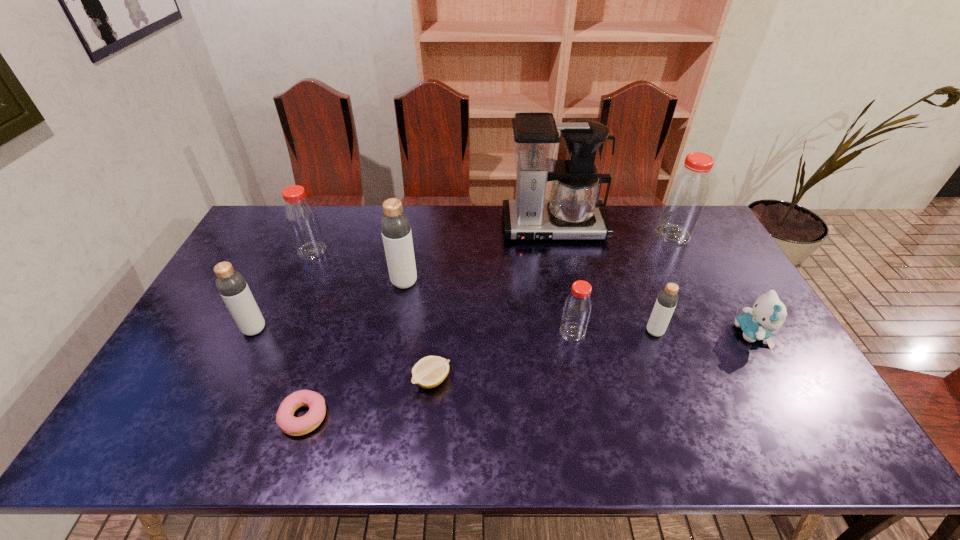
Where is `coffee maker situated at the far edge`? The height and width of the screenshot is (540, 960). coffee maker situated at the far edge is located at coordinates (574, 212).

Locate an element on the screen. object located in the near edge section of the desktop is located at coordinates (295, 426).

The width and height of the screenshot is (960, 540). I want to click on object that is at the left edge, so click(x=232, y=286).

The image size is (960, 540). What are the coordinates of `bottle present at the right edge` in the screenshot? It's located at point(685,200).

Locate an element on the screen. kitten located at the right edge is located at coordinates (768, 314).

Locate an element on the screen. object situated at the far right corner is located at coordinates (685, 200).

Identify the location of free space at the far edge of the desktop. The width and height of the screenshot is (960, 540). (617, 220).

This screenshot has width=960, height=540. Find the location of `free space at the near edge`. free space at the near edge is located at coordinates (285, 447).

In the image, there is a desktop. Where is `vacant space at the left edge`? vacant space at the left edge is located at coordinates (201, 335).

You are a GUI agent. You are given a task and a screenshot of the screen. Output one action in this format:
    pyautogui.click(x=<x>, y=<y>)
    Task: Click on the vacant space at the far left corner
    The height and width of the screenshot is (540, 960).
    Given the screenshot: What is the action you would take?
    tap(259, 231)